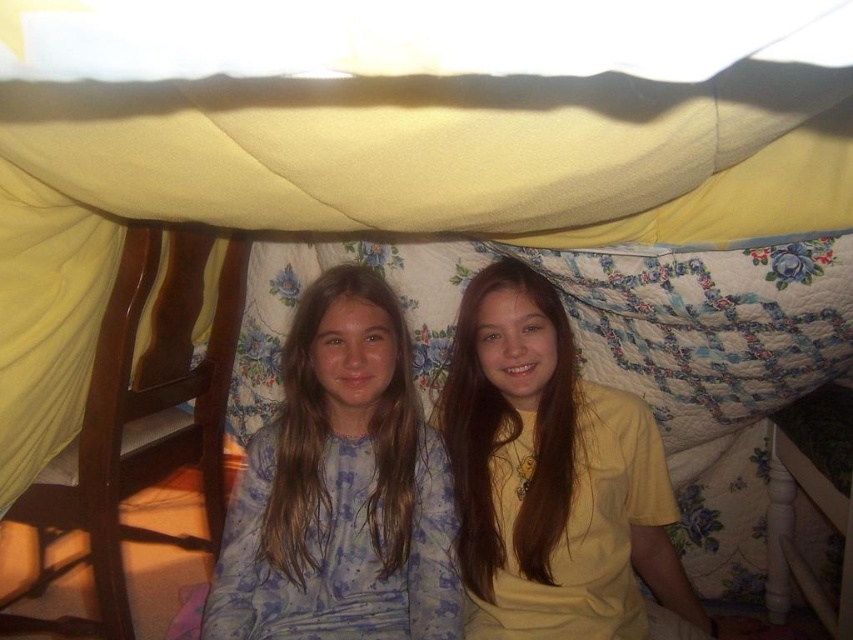
Question: Is yellow fabric canopy at upper center to the right of light blue pajamas at center from the viewer's perspective?

Choices:
 (A) no
 (B) yes

Answer: (B)

Question: Is yellow fabric canopy at upper center wider than light blue pajamas at center?

Choices:
 (A) no
 (B) yes

Answer: (B)

Question: Estimate the real-world distances between objects in this image. Which object is farther from the light blue pajamas at center?

Choices:
 (A) yellow fabric canopy at upper center
 (B) yellow matte shirt at center

Answer: (A)

Question: Which object appears farthest from the camera in this image?

Choices:
 (A) light blue pajamas at center
 (B) yellow fabric canopy at upper center
 (C) yellow matte shirt at center

Answer: (C)

Question: Does light blue pajamas at center appear under yellow matte shirt at center?

Choices:
 (A) no
 (B) yes

Answer: (A)

Question: Which point is closer to the camera taking this photo?

Choices:
 (A) (201, 124)
 (B) (311, 609)

Answer: (A)